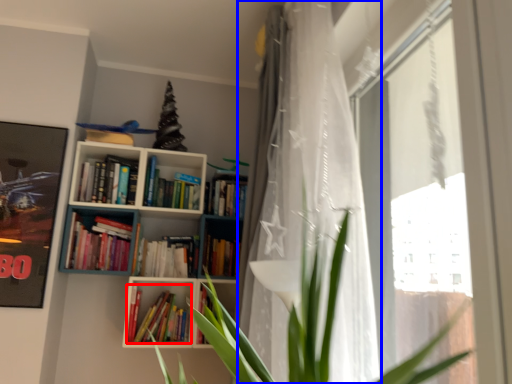
Question: Which object is further to the camera taking this photo, book (highlighted by a red box) or curtain (highlighted by a blue box)?

Choices:
 (A) book
 (B) curtain

Answer: (A)